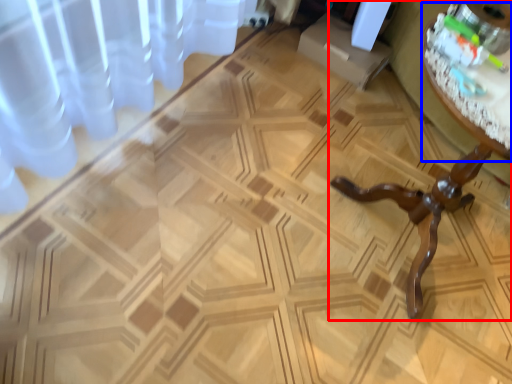
Question: Among these objects, which one is farthest to the camera, table (highlighted by a red box) or round table (highlighted by a blue box)?

Choices:
 (A) table
 (B) round table

Answer: (B)